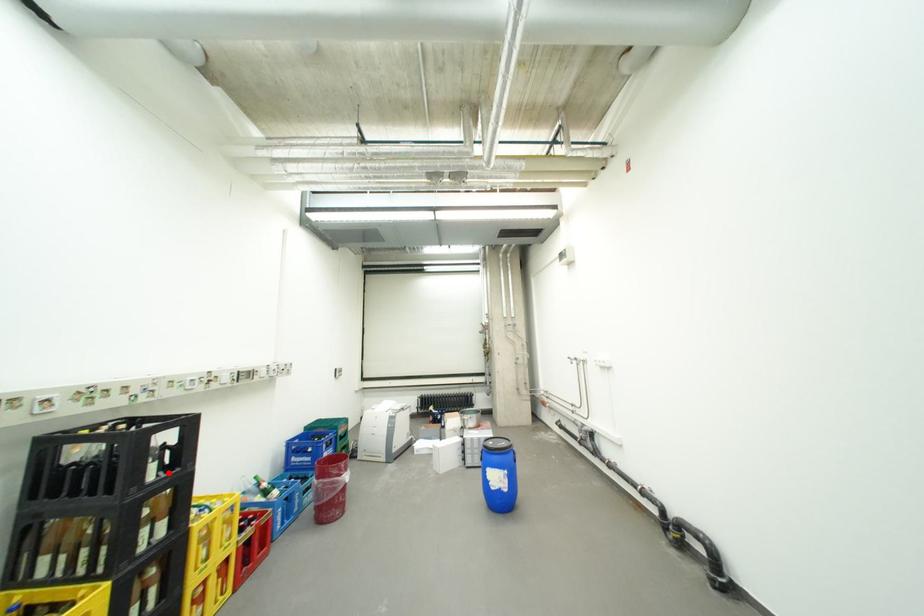
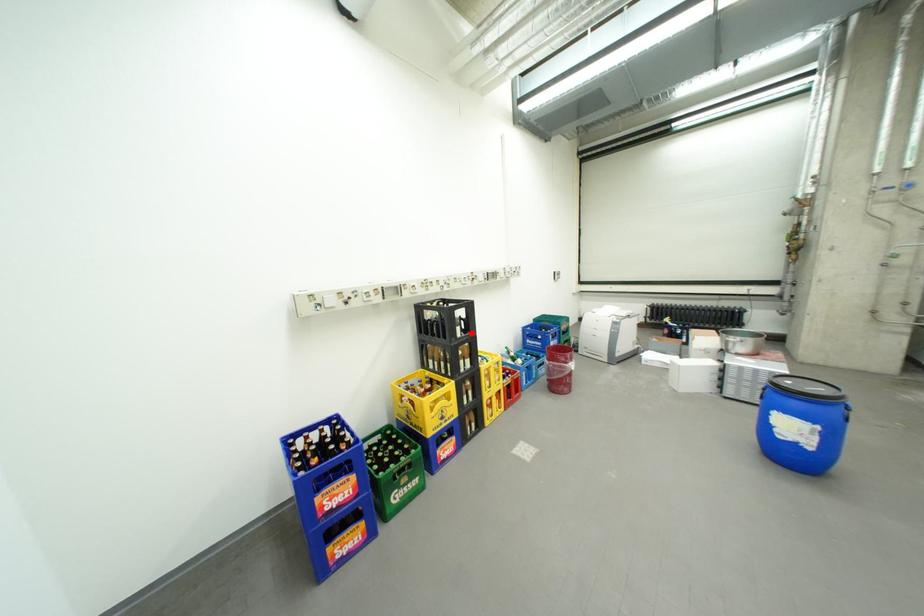
Looking at this image, I am providing you with two images of the same scene from different viewpoints. A red point is marked on the first image and another point is marked on the second image. Is the marked point in image1 the same physical position as the marked point in image2?

Yes